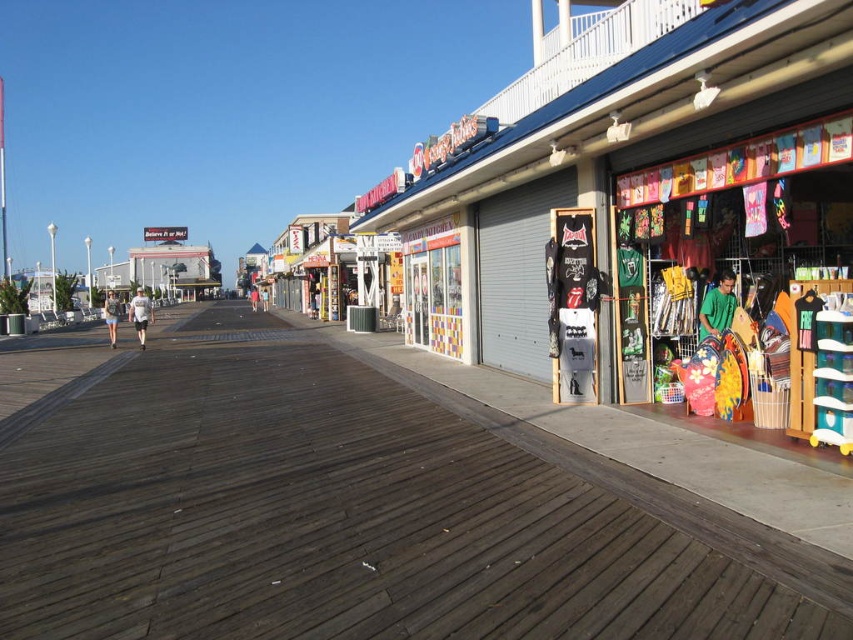
Who is more distant from viewer, (134, 326) or (113, 300)?

Point (113, 300)

Is point (138, 323) in front of point (111, 333)?

Yes.

Locate an element on the screen. Image resolution: width=853 pixels, height=640 pixels. white cotton shirt at center is located at coordinates (140, 314).

Who is more distant from viewer, (107,552) or (109,298)?

The point (109,298) is behind.

Between dark brown wood at center and white cotton shorts at lower left, which one is positioned lower?

Positioned lower is dark brown wood at center.

Does point (292, 355) come farther from viewer compared to point (112, 310)?

No, it is in front of (112, 310).

The height and width of the screenshot is (640, 853). I want to click on dark brown wood at center, so click(x=358, y=513).

What do you see at coordinates (358, 513) in the screenshot? The width and height of the screenshot is (853, 640). I see `dark brown wood at center` at bounding box center [358, 513].

Does point (167, 358) lie behind point (138, 301)?

No.

Measure the distance between dark brown wood at center and camera.

The distance of dark brown wood at center from camera is 3.23 meters.

At what (x,y) coordinates should I click in order to perform the action: click on dark brown wood at center. Please return your answer as a coordinate pair (x, y). The width and height of the screenshot is (853, 640). Looking at the image, I should click on (358, 513).